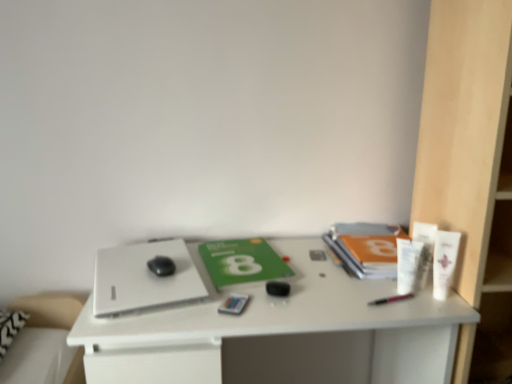
The image size is (512, 384). Find the location of `free point behind black matte mouse at center`. free point behind black matte mouse at center is located at coordinates (160, 250).